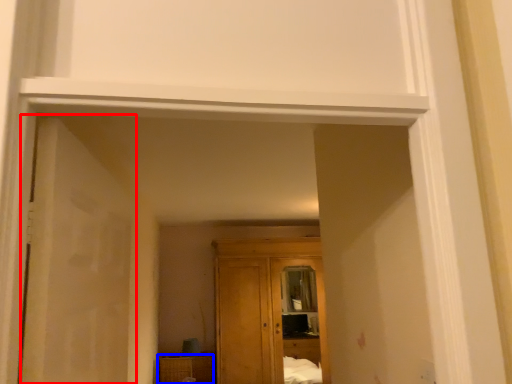
Question: Which of the following is the farthest to the observer, door (highlighted by a red box) or cabinetry (highlighted by a blue box)?

Choices:
 (A) door
 (B) cabinetry

Answer: (B)